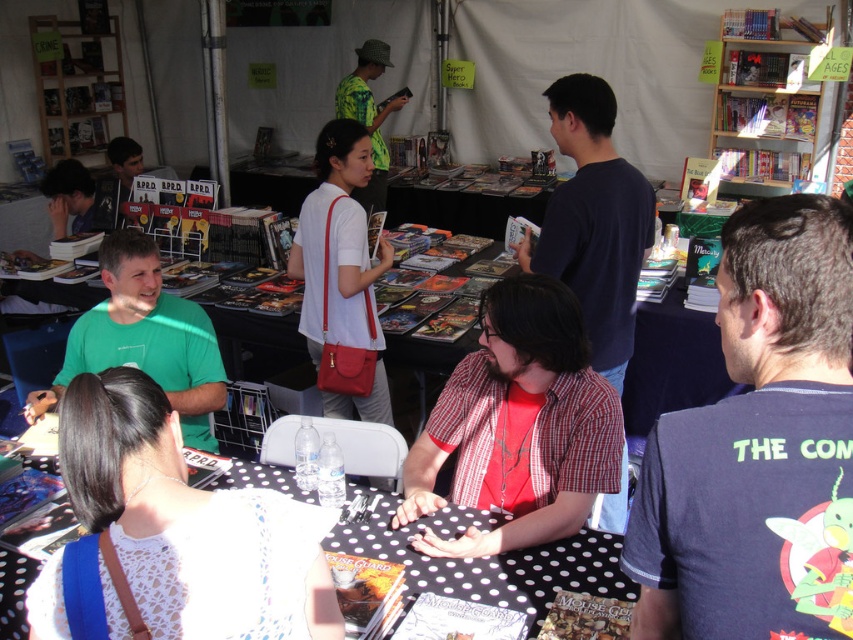
Can you confirm if wooden bookshelf at upper right is thinner than matte black shirt at upper left?

In fact, wooden bookshelf at upper right might be wider than matte black shirt at upper left.

Does wooden bookshelf at upper right have a larger size compared to matte black shirt at upper left?

Correct, wooden bookshelf at upper right is larger in size than matte black shirt at upper left.

Does point (784, 49) lie behind point (107, 230)?

Yes, it is behind point (107, 230).

Where is `wooden bookshelf at upper right`? wooden bookshelf at upper right is located at coordinates (764, 106).

Between dark blue shirt at center and white matte bag at center, which one appears on the left side from the viewer's perspective?

white matte bag at center

Is point (596, 145) closer to viewer compared to point (351, 120)?

Yes, it is in front of point (351, 120).

Find the location of a particular element. dark blue shirt at center is located at coordinates (595, 221).

Is point (724, 42) positioned behind point (379, 144)?

No, it is in front of (379, 144).

Is wooden bookshelf at upper right thinner than green textured shirt at center?

Incorrect, wooden bookshelf at upper right's width is not less than green textured shirt at center's.

What do you see at coordinates (764, 106) in the screenshot? I see `wooden bookshelf at upper right` at bounding box center [764, 106].

What are the coordinates of `wooden bookshelf at upper right` in the screenshot? It's located at (764, 106).